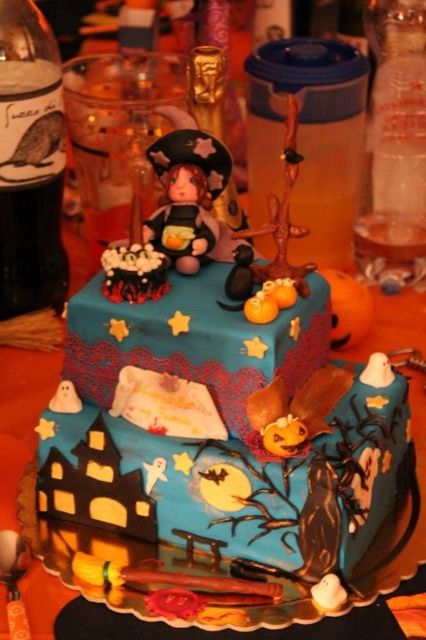
Question: Which point is closer to the camera?

Choices:
 (A) (186, 252)
 (B) (25, 88)

Answer: (A)

Question: Does translucent glass bottle at left have a smaller size compared to matte plastic witch at center?

Choices:
 (A) yes
 (B) no

Answer: (B)

Question: Does translucent glass bottle at left appear on the right side of matte plastic witch at center?

Choices:
 (A) no
 (B) yes

Answer: (A)

Question: Which object appears closest to the camera in this image?

Choices:
 (A) translucent glass bottle at left
 (B) matte plastic witch at center

Answer: (B)

Question: Is translucent glass bottle at left closer to camera compared to matte plastic witch at center?

Choices:
 (A) yes
 (B) no

Answer: (B)

Question: Which of the following is the closest to the observer?

Choices:
 (A) (218, 145)
 (B) (51, 230)

Answer: (A)